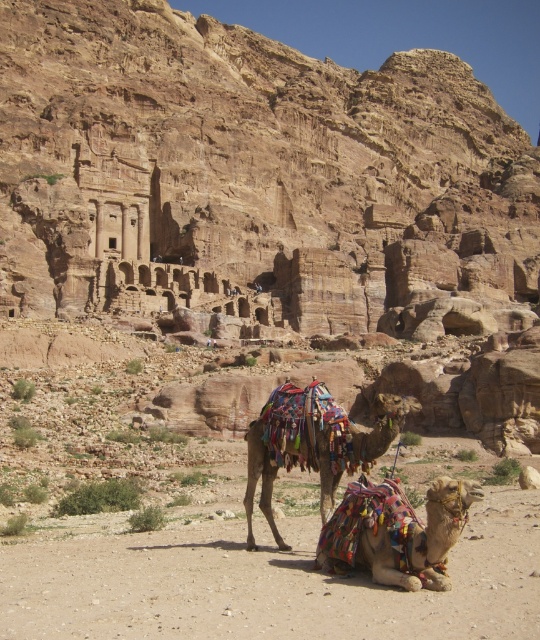
Question: Considering the relative positions of multicolored fabric camel at lower center and multicolored fabric camel at center in the image provided, where is multicolored fabric camel at lower center located with respect to multicolored fabric camel at center?

Choices:
 (A) right
 (B) left

Answer: (A)

Question: Which object is farther from the camera taking this photo?

Choices:
 (A) multicolored fabric camel at center
 (B) multicolored fabric camel at lower center

Answer: (A)

Question: Which object is farther from the camera taking this photo?

Choices:
 (A) multicolored fabric camel at center
 (B) multicolored fabric camel at lower center

Answer: (A)

Question: Among these objects, which one is farthest from the camera?

Choices:
 (A) multicolored fabric camel at center
 (B) multicolored fabric camel at lower center

Answer: (A)

Question: Does multicolored fabric camel at lower center appear on the left side of multicolored fabric camel at center?

Choices:
 (A) no
 (B) yes

Answer: (A)

Question: Does multicolored fabric camel at lower center appear on the left side of multicolored fabric camel at center?

Choices:
 (A) yes
 (B) no

Answer: (B)